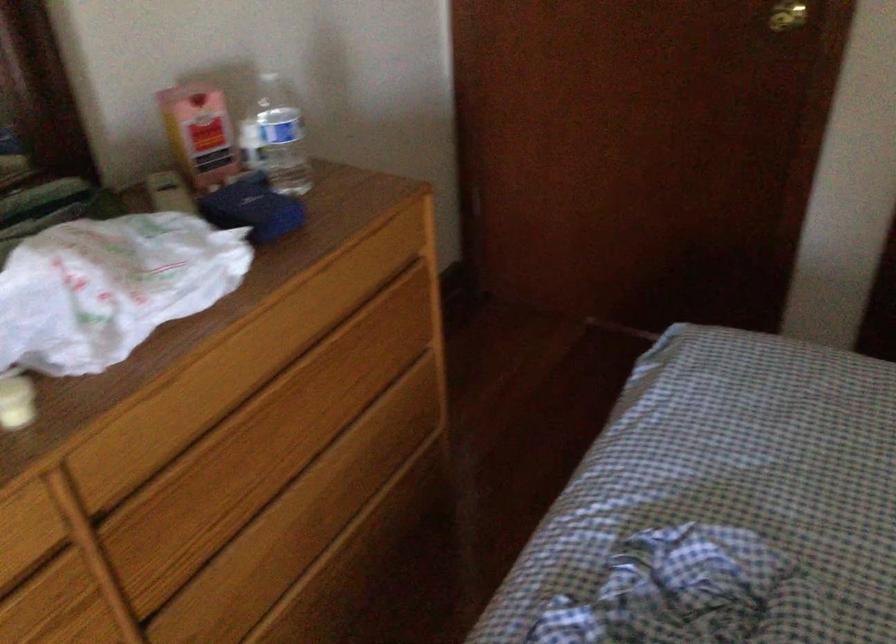
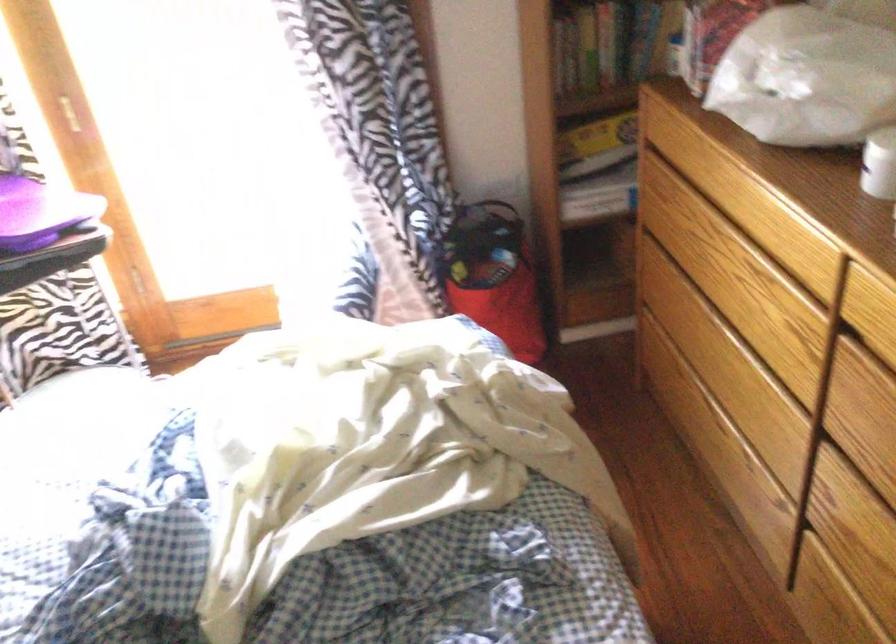
Locate, in the second image, the point that corresponds to point 136,476 in the first image.

(874, 339)